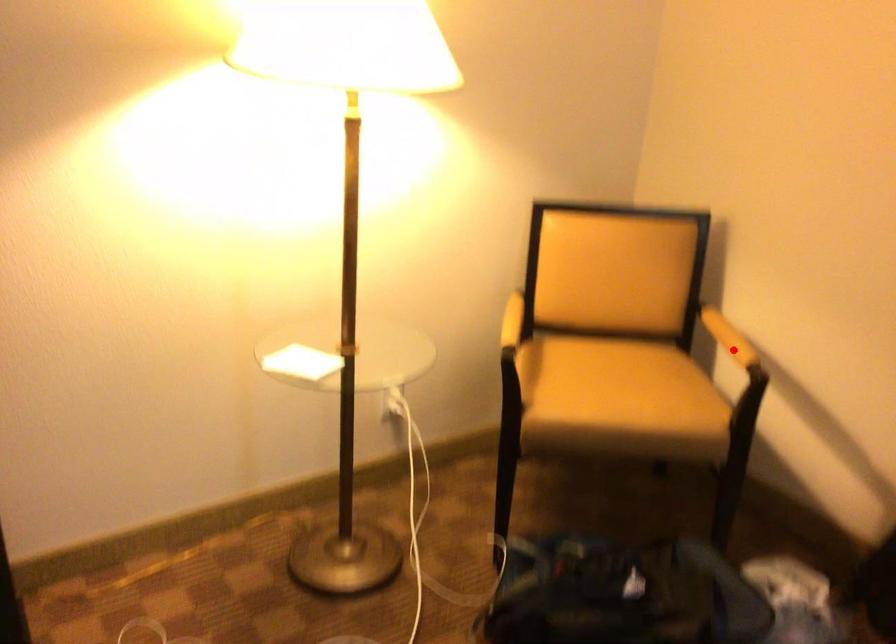
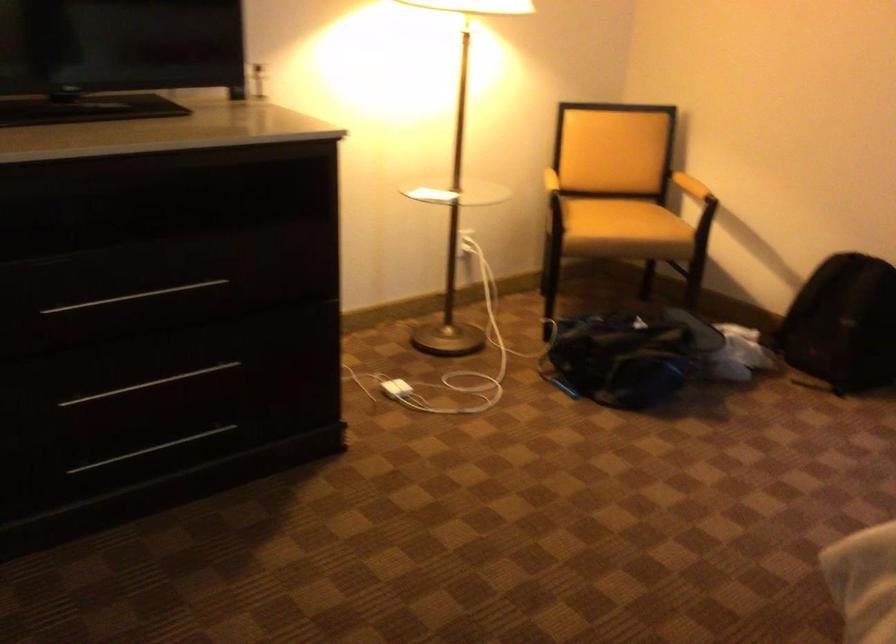
Question: I am providing you with two images of the same scene from different viewpoints. In image1, a red point is highlighted. Considering the same 3D point in image2, which of the following is correct?

Choices:
 (A) It is closer
 (B) It is farther

Answer: (B)